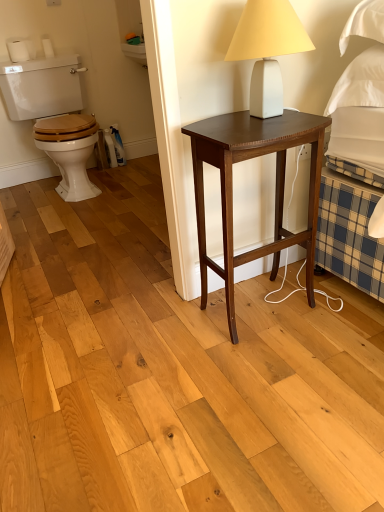
Question: In the image, is wooden at left on the left side or the right side of dark wood nightstand at center?

Choices:
 (A) left
 (B) right

Answer: (A)

Question: Is wooden at left bigger or smaller than dark wood nightstand at center?

Choices:
 (A) big
 (B) small

Answer: (A)

Question: Which object is the farthest from the wooden at left?

Choices:
 (A) dark wood nightstand at center
 (B) white matte table lamp at upper right

Answer: (B)

Question: Estimate the real-world distances between objects in this image. Which object is farther from the dark wood nightstand at center?

Choices:
 (A) white matte table lamp at upper right
 (B) wooden at left

Answer: (B)